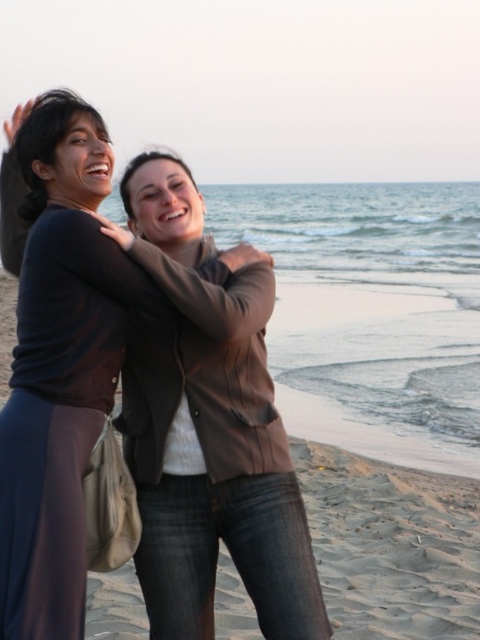
Question: Which object is positioned farthest from the matte black hair at upper left?

Choices:
 (A) matte brown jacket at center
 (B) brown leather jacket at center

Answer: (B)

Question: Does brown leather jacket at center come in front of matte brown jacket at center?

Choices:
 (A) yes
 (B) no

Answer: (B)

Question: In this image, where is matte brown jacket at center located relative to matte black hair at upper left?

Choices:
 (A) below
 (B) above

Answer: (A)

Question: Is matte brown jacket at center below matte black hair at upper left?

Choices:
 (A) no
 (B) yes

Answer: (B)

Question: Among these objects, which one is nearest to the camera?

Choices:
 (A) matte black hair at upper left
 (B) brown leather jacket at center

Answer: (B)

Question: Which point is closer to the camera taking this photo?

Choices:
 (A) (143, 212)
 (B) (57, 397)
 (C) (54, 154)

Answer: (B)